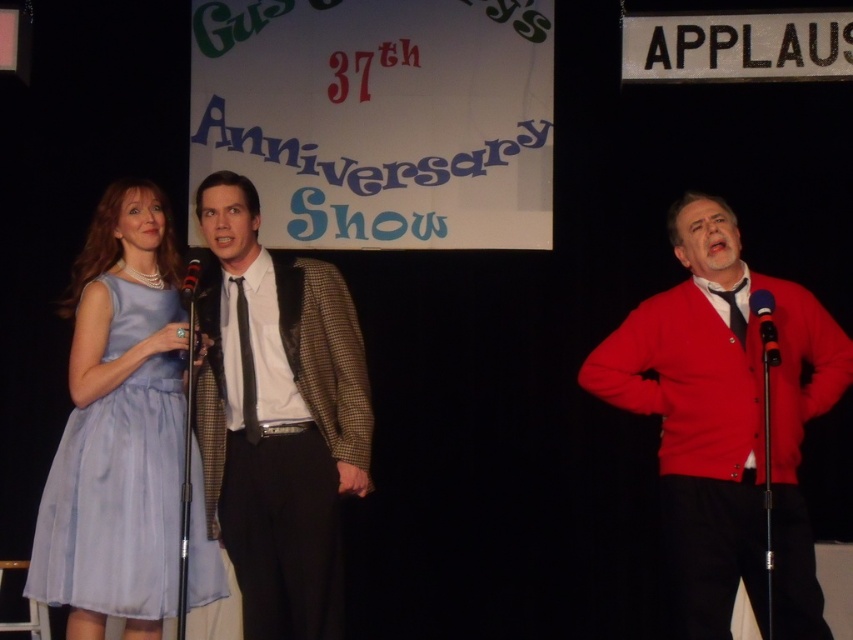
Is the position of houndstooth fabric blazer at center more distant than that of black plastic microphone at center?

Yes, it is.

Who is lower down, houndstooth fabric blazer at center or black plastic microphone at center?

houndstooth fabric blazer at center is lower down.

Image resolution: width=853 pixels, height=640 pixels. In order to click on houndstooth fabric blazer at center in this screenshot , I will do `click(277, 417)`.

Who is positioned more to the right, houndstooth fabric blazer at center or light blue chiffon dress at left?

houndstooth fabric blazer at center is more to the right.

Which is above, houndstooth fabric blazer at center or light blue chiffon dress at left?

houndstooth fabric blazer at center

Where is `houndstooth fabric blazer at center`? houndstooth fabric blazer at center is located at coordinates (277, 417).

Is point (131, 448) closer to camera compared to point (751, 435)?

No, (131, 448) is behind (751, 435).

Measure the distance between point (42,576) and camera.

Point (42,576) is 12.30 feet away from camera.

Is point (149, 358) behind point (842, 360)?

Yes, point (149, 358) is behind point (842, 360).

Find the location of a particular element. The image size is (853, 640). light blue chiffon dress at left is located at coordinates (115, 500).